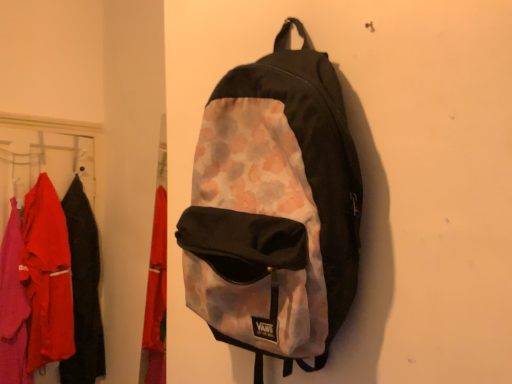
Question: Does matte black jacket at left have a larger size compared to watercolor-patterned fabric backpack at center?

Choices:
 (A) yes
 (B) no

Answer: (B)

Question: Can you confirm if matte black jacket at left is wider than watercolor-patterned fabric backpack at center?

Choices:
 (A) no
 (B) yes

Answer: (B)

Question: Is the position of matte black jacket at left less distant than that of watercolor-patterned fabric backpack at center?

Choices:
 (A) no
 (B) yes

Answer: (A)

Question: Is matte black jacket at left oriented towards watercolor-patterned fabric backpack at center?

Choices:
 (A) no
 (B) yes

Answer: (A)

Question: Are matte black jacket at left and watercolor-patterned fabric backpack at center far apart?

Choices:
 (A) yes
 (B) no

Answer: (A)

Question: Considering the relative positions of matte black jacket at left and watercolor-patterned fabric backpack at center in the image provided, is matte black jacket at left to the left of watercolor-patterned fabric backpack at center from the viewer's perspective?

Choices:
 (A) yes
 (B) no

Answer: (A)

Question: Is watercolor-patterned fabric backpack at center at the left side of matte fabric clothes at left?

Choices:
 (A) yes
 (B) no

Answer: (B)

Question: Is watercolor-patterned fabric backpack at center turned away from matte fabric clothes at left?

Choices:
 (A) no
 (B) yes

Answer: (A)

Question: Can you confirm if watercolor-patterned fabric backpack at center is wider than matte fabric clothes at left?

Choices:
 (A) no
 (B) yes

Answer: (B)

Question: From the image's perspective, is watercolor-patterned fabric backpack at center under matte fabric clothes at left?

Choices:
 (A) no
 (B) yes

Answer: (A)

Question: Is watercolor-patterned fabric backpack at center shorter than matte fabric clothes at left?

Choices:
 (A) yes
 (B) no

Answer: (A)

Question: Is watercolor-patterned fabric backpack at center in front of matte fabric clothes at left?

Choices:
 (A) yes
 (B) no

Answer: (A)

Question: Is matte fabric clothes at left next to watercolor-patterned fabric backpack at center and touching it?

Choices:
 (A) no
 (B) yes

Answer: (A)